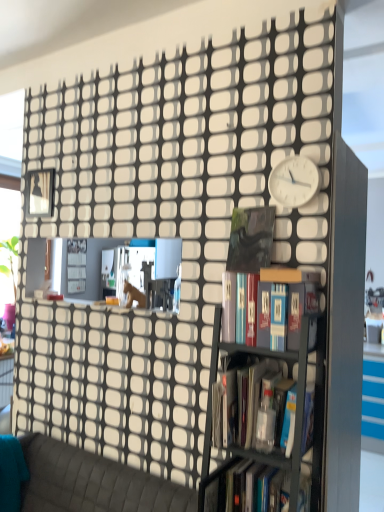
Question: From the image's perspective, is matte black book at upper center above or below hardcover books at center, marked as the 3th book in a bottom-to-top arrangement?

Choices:
 (A) below
 (B) above

Answer: (B)

Question: Is matte black book at upper center spatially inside hardcover books at center, the first book viewed from the top, or outside of it?

Choices:
 (A) inside
 (B) outside

Answer: (B)

Question: Estimate the real-world distances between objects in this image. Which object is closer to the hardcover book at center, which is counted as the third book, starting from the top?

Choices:
 (A) metallic gray bookcase at center
 (B) hardcover books at center, marked as the 3th book in a bottom-to-top arrangement
 (C) matte black book at upper center
 (D) translucent plastic bottle at center, acting as the second book starting from the bottom
 (E) white plastic clock at upper right

Answer: (A)

Question: Which is nearer to the textured gray couch at lower left?

Choices:
 (A) metallic gray bookcase at center
 (B) translucent plastic bottle at center, which appears as the 2th book when viewed from the top
 (C) hardcover book at center, which ranks as the 1th book in bottom-to-top order
 (D) matte black book at upper center
 (E) hardcover books at center, the first book viewed from the top

Answer: (C)